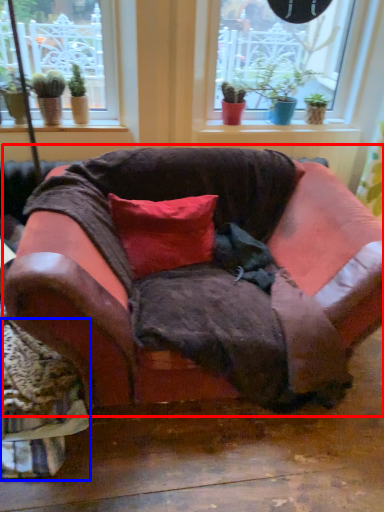
Question: Which object appears closest to the camera in this image, studio couch (highlighted by a red box) or swivel chair (highlighted by a blue box)?

Choices:
 (A) studio couch
 (B) swivel chair

Answer: (A)